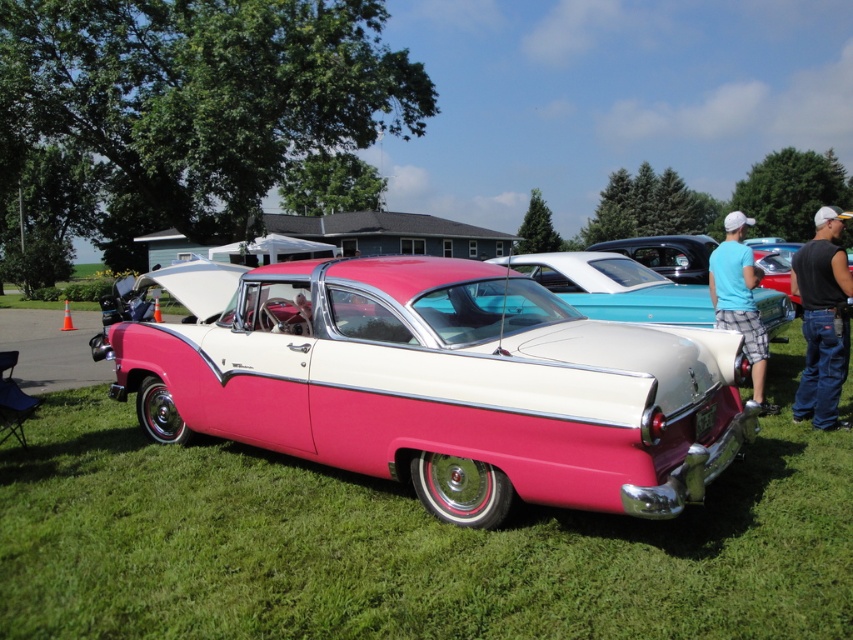
Looking at this image, you are a photographer planning to capture the vintage car and its surroundings. You notice the green grass at center and the blue cotton shirt at right in your frame. Based on their widths, which object would appear narrower in the photo?

The green grass at center would appear narrower in the photo since its width is less than that of the blue cotton shirt at right.

You are a photographer at the car show and want to capture both the pink glossy car at center and the black sleeveless shirt at right in a single shot. Since you want the car to appear larger in the photo than the shirt, which object should you place closer to the camera?

The pink glossy car at center must be placed closer to the camera because it has a lesser height compared to the black sleeveless shirt at right, so moving it closer will make it appear larger in the photo.